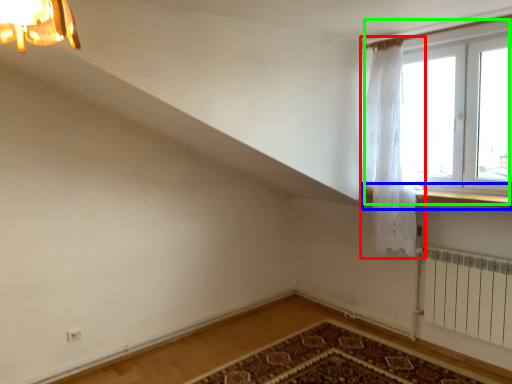
Question: Estimate the real-world distances between objects in this image. Which object is closer to curtain (highlighted by a red box), window sill (highlighted by a blue box) or window (highlighted by a green box)?

Choices:
 (A) window sill
 (B) window

Answer: (B)